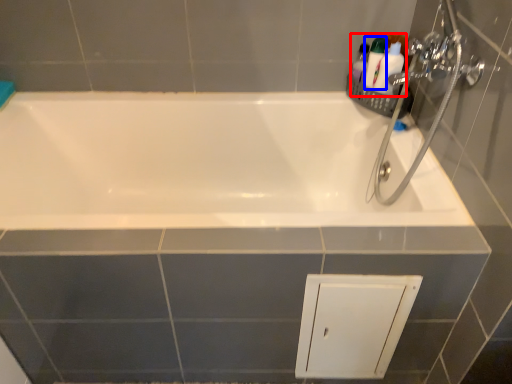
Question: Which of the following is the farthest to the observer, toiletry (highlighted by a red box) or toiletry (highlighted by a blue box)?

Choices:
 (A) toiletry
 (B) toiletry

Answer: (B)